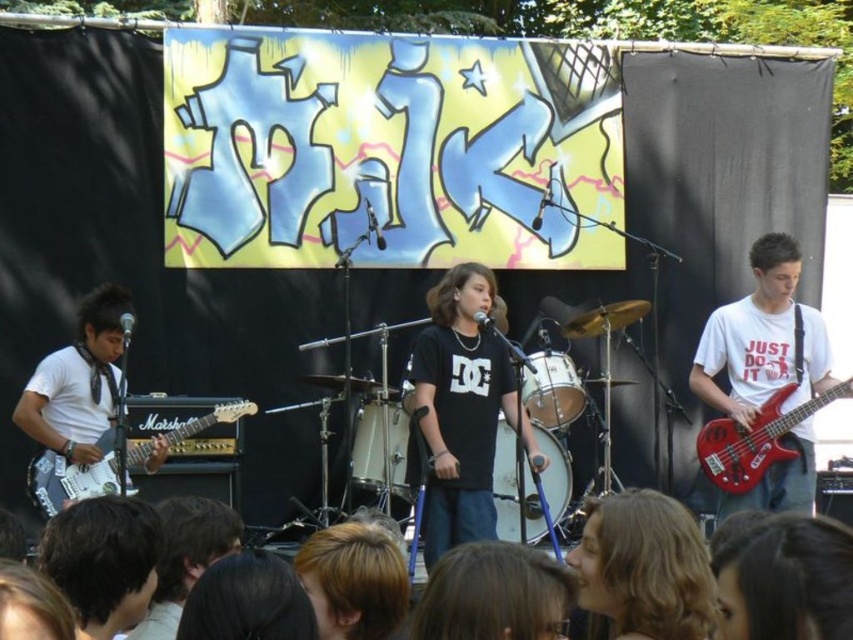
Is black matte shirt at center taller than white glossy marshall amplifier at lower left?

Yes, black matte shirt at center is taller than white glossy marshall amplifier at lower left.

Who is positioned more to the left, black matte shirt at center or white glossy marshall amplifier at lower left?

Positioned to the left is white glossy marshall amplifier at lower left.

Does point (450, 445) lie in front of point (38, 493)?

That is False.

The width and height of the screenshot is (853, 640). Find the location of `black matte shirt at center`. black matte shirt at center is located at coordinates (462, 410).

Can you confirm if white matte guitar at left is wider than shiny red electric bass at right?

No, white matte guitar at left is not wider than shiny red electric bass at right.

Is point (157, 442) positioned before point (715, 452)?

Yes, it is.

This screenshot has height=640, width=853. What are the coordinates of `white matte guitar at left` in the screenshot? It's located at (78, 381).

Which is below, brown hair at lower center or white matte guitar at left?

brown hair at lower center is below.

Can you confirm if brown hair at lower center is taller than white matte guitar at left?

In fact, brown hair at lower center may be shorter than white matte guitar at left.

Between point (813, 637) and point (39, 388), which one is positioned behind?

Positioned behind is point (39, 388).

I want to click on brown hair at lower center, so click(x=785, y=580).